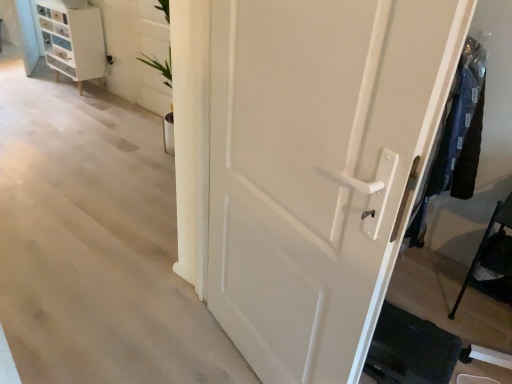
Identify the location of free region on the left part of white matte door at center. (190, 357).